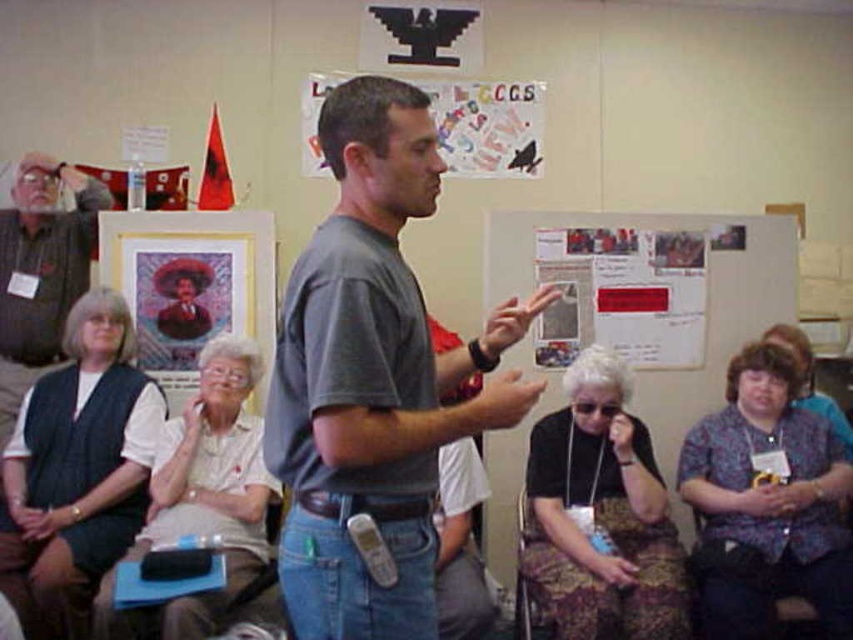
You are an observer in the scene. You notice two clothing items in the room. The first is the dark blue textured vest at left, and the second is the white fabric shirt at center. Which clothing item appears taller?

The dark blue textured vest at left appears taller than the white fabric shirt at center.

You are organizing a clothing donation drive and need to determine which items can fit into a small donation box that accommodates garments up to 40 cm in width. You have two items to assess from the scene described. Which garment, the dark blue textured vest at left or the white fabric shirt at center, is more likely to exceed the box size limit?

The dark blue textured vest at left is wider than the white fabric shirt at center, so it is more likely to exceed the 40 cm width limit for the donation box.

You are organizing a community event and need to decide whether to place a decorative banner between the dark blue textured vest at left and the printed paper poster at center. The banner requires 3 inches of space. Can you fit it there?

The dark blue textured vest at left is thinner than the printed paper poster at center, but the exact dimensions aren